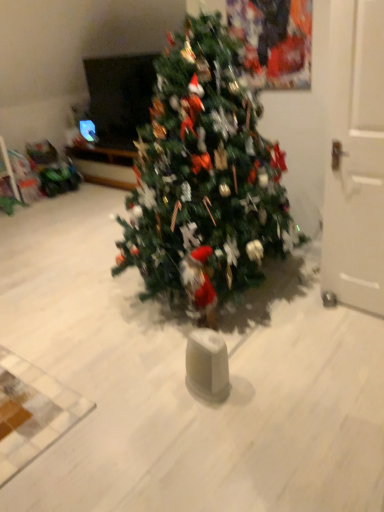
Where is `vacant area that is in front of white matte door at right`? vacant area that is in front of white matte door at right is located at coordinates (347, 333).